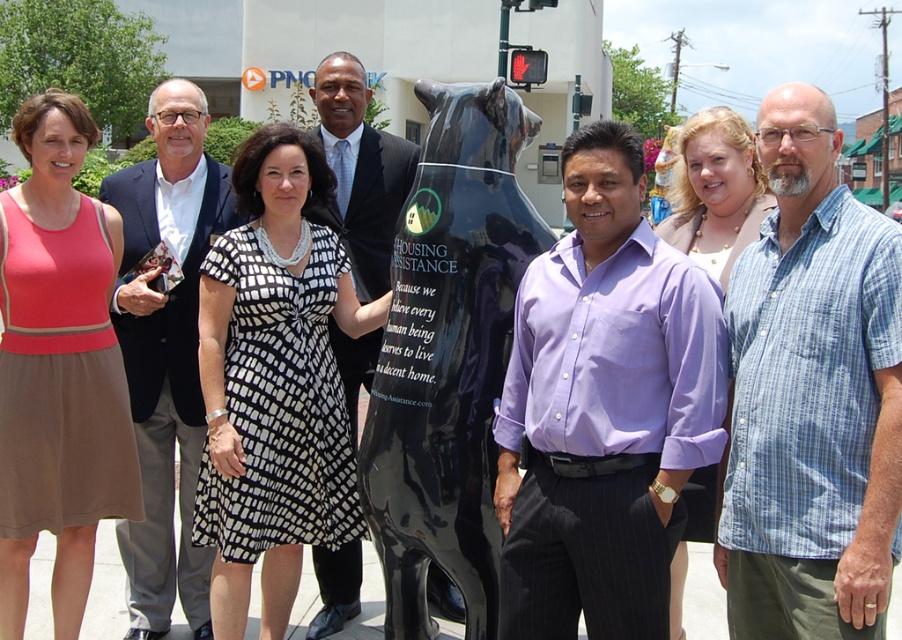
Looking at this image, is black and white dress at center smaller than pink fabric dress at left?

Actually, black and white dress at center might be larger than pink fabric dress at left.

Can you confirm if black and white dress at center is shorter than pink fabric dress at left?

Yes, black and white dress at center is shorter than pink fabric dress at left.

Is point (336, 301) positioned after point (67, 515)?

Yes, point (336, 301) is farther from viewer.

At what (x,y) coordinates should I click in order to perform the action: click on black and white dress at center. Please return your answer as a coordinate pair (x, y). The image size is (902, 640). Looking at the image, I should click on (275, 384).

Can you confirm if purple cotton shirt at center is bigger than black glossy bear at center?

Actually, purple cotton shirt at center might be smaller than black glossy bear at center.

Is purple cotton shirt at center shorter than black glossy bear at center?

Yes.

Does point (628, 554) come farther from viewer compared to point (468, 349)?

That is False.

Identify the location of purple cotton shirt at center. This screenshot has width=902, height=640. (603, 408).

Between point (634, 220) and point (75, 333), which one is positioned behind?

The point (75, 333) is more distant.

Where is `purple cotton shirt at center`? The height and width of the screenshot is (640, 902). purple cotton shirt at center is located at coordinates (603, 408).